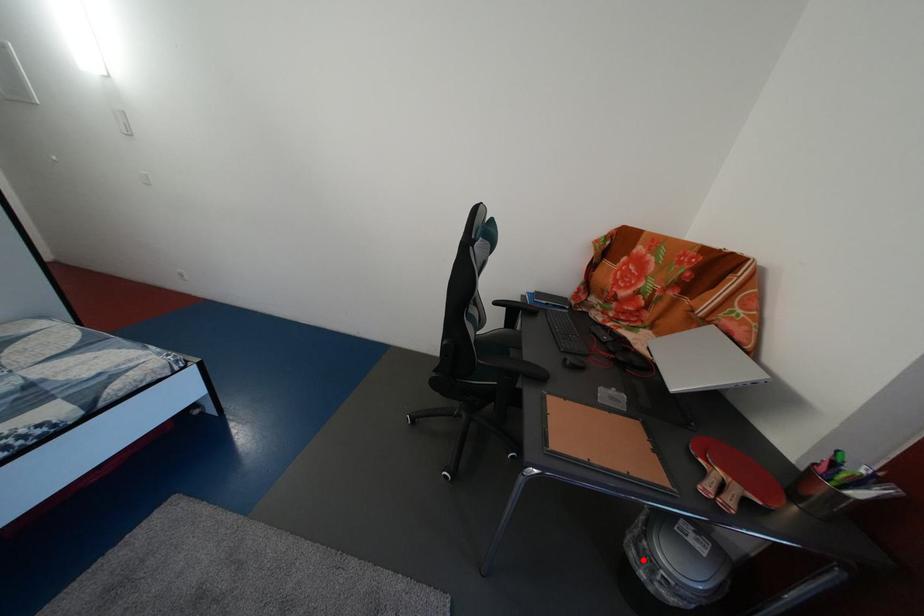
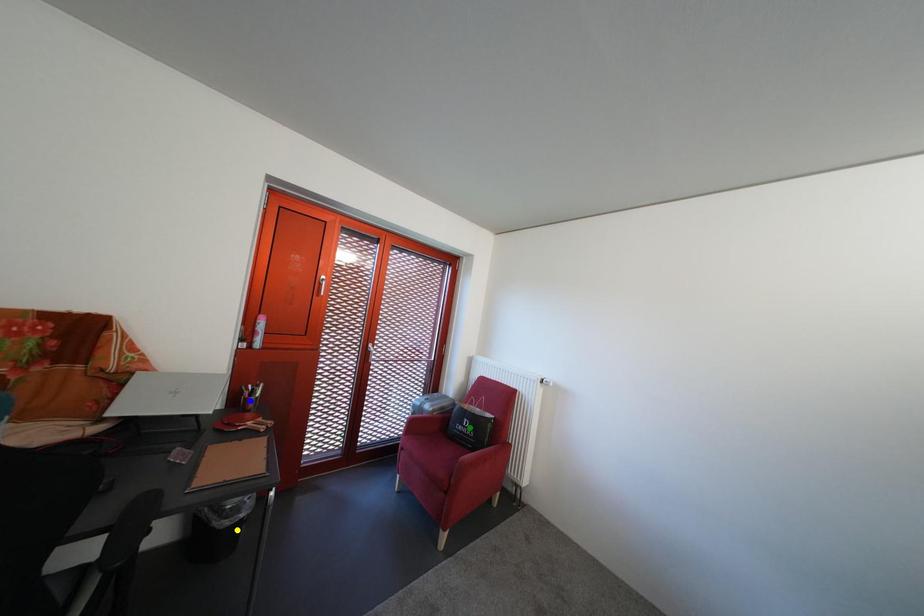
Question: I am providing you with two images of the same scene from different viewpoints. A red point is marked on the first image. You are given multiple points on the second image. Which spot in image 2 lines up with the point in image 1?

Choices:
 (A) blue point
 (B) yellow point
 (C) green point

Answer: (B)